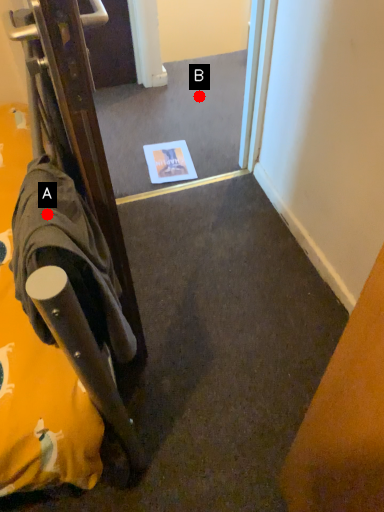
Question: Two points are circled on the image, labeled by A and B beside each circle. Which point appears farthest from the camera in this image?

Choices:
 (A) A is further
 (B) B is further

Answer: (B)